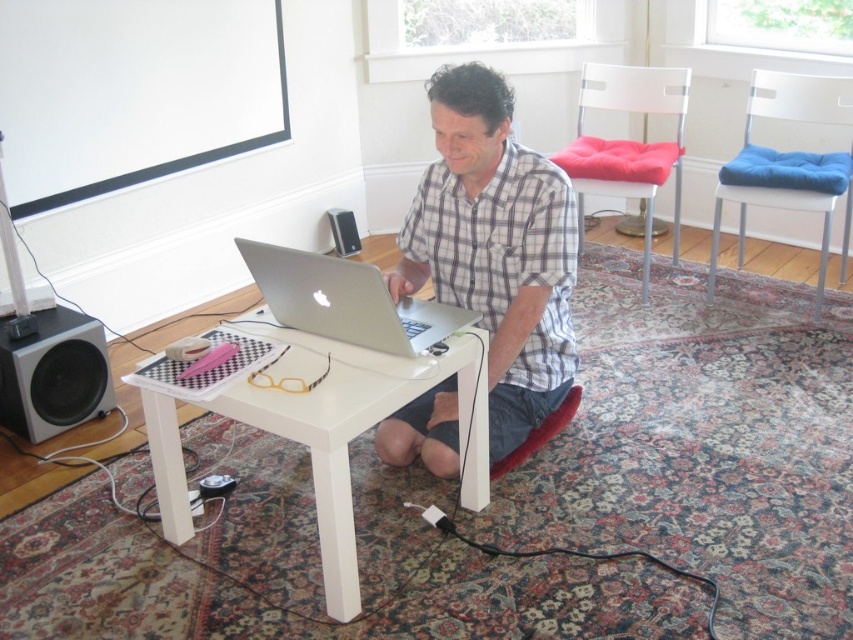
Can you confirm if silver metallic laptop at center is smaller than black plastic speaker at lower left?

Incorrect, silver metallic laptop at center is not smaller in size than black plastic speaker at lower left.

Between silver metallic laptop at center and black plastic speaker at lower left, which one appears on the right side from the viewer's perspective?

silver metallic laptop at center is more to the right.

This screenshot has width=853, height=640. Describe the element at coordinates (346, 300) in the screenshot. I see `silver metallic laptop at center` at that location.

This screenshot has height=640, width=853. I want to click on silver metallic laptop at center, so click(346, 300).

The width and height of the screenshot is (853, 640). I want to click on white checkered shirt at center, so pos(495,248).

Who is lower down, white checkered shirt at center or white glossy table at center?

Positioned lower is white glossy table at center.

Does point (477, 291) come in front of point (154, 413)?

No, (477, 291) is behind (154, 413).

Identify the location of white checkered shirt at center. This screenshot has width=853, height=640. (495, 248).

Who is more distant from viewer, (561, 326) or (320, 300)?

The point (561, 326) is more distant.

Can you confirm if white checkered shirt at center is positioned to the right of silver metallic laptop at center?

Correct, you'll find white checkered shirt at center to the right of silver metallic laptop at center.

Is point (456, 232) positioned after point (428, 326)?

Yes, it is behind point (428, 326).

You are a GUI agent. You are given a task and a screenshot of the screen. Output one action in this format:
    pyautogui.click(x=<x>, y=<y>)
    Task: Click on the white checkered shirt at center
    
    Given the screenshot: What is the action you would take?
    pyautogui.click(x=495, y=248)